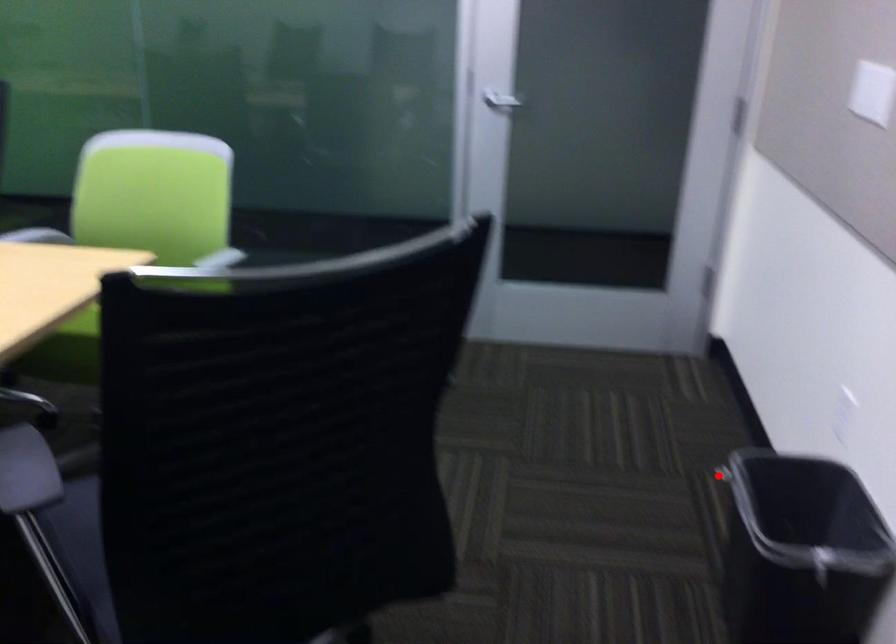
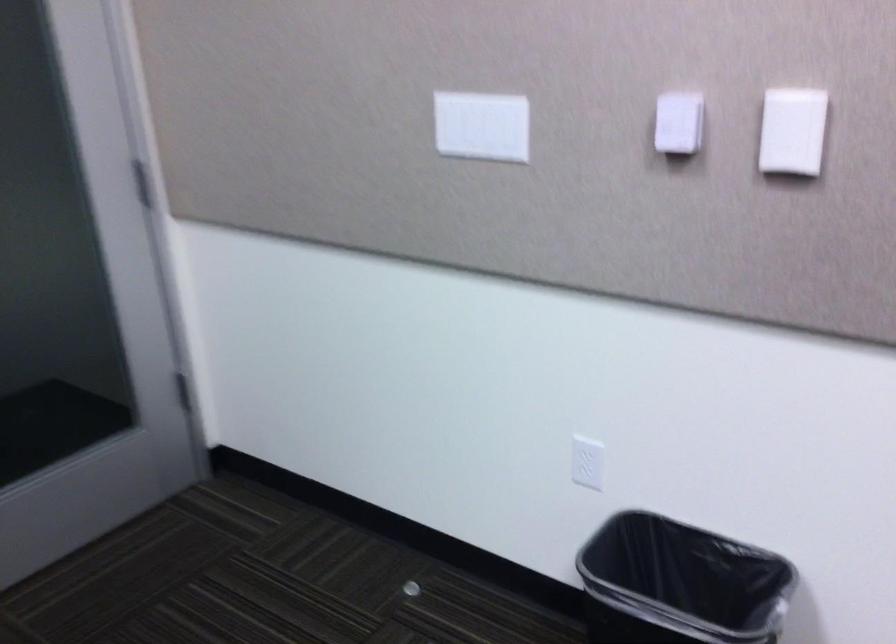
In the second image, find the point that corresponds to the highlighted location in the first image.

(410, 589)